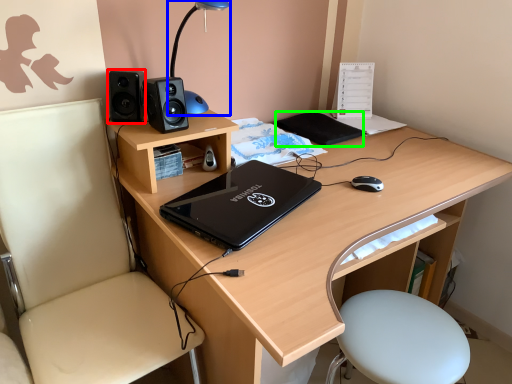
Question: Estimate the real-world distances between objects in this image. Which object is farther from speaker (highlighted by a red box), table lamp (highlighted by a blue box) or notepad (highlighted by a green box)?

Choices:
 (A) table lamp
 (B) notepad

Answer: (B)